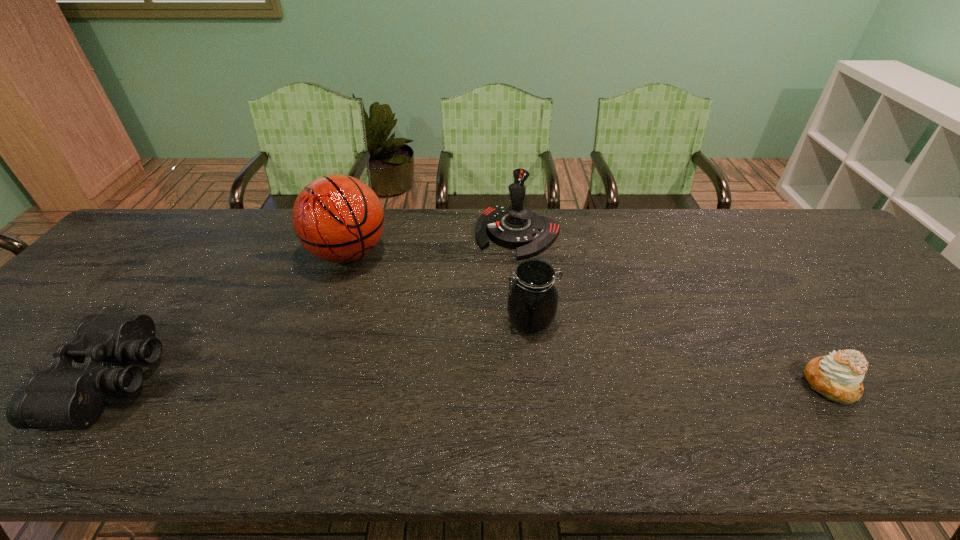
Identify the location of joystick located in the far edge section of the desktop. (516, 227).

Locate an element on the screen. This screenshot has width=960, height=540. binoculars located in the near edge section of the desktop is located at coordinates (62, 396).

Find the location of a particular element. Image resolution: width=960 pixels, height=540 pixels. pastry that is at the near edge is located at coordinates (838, 376).

Identify the location of vacant space at the far edge of the desktop. (718, 249).

In order to click on vacant space at the near edge of the desktop in this screenshot , I will do `click(342, 397)`.

Where is `free space at the left edge of the desktop`? The height and width of the screenshot is (540, 960). free space at the left edge of the desktop is located at coordinates (68, 309).

In the image, there is a desktop. Identify the location of vacant space at the far right corner. (787, 240).

At what (x,y) coordinates should I click in order to perform the action: click on vacant area at the near right corner. Please return your answer as a coordinate pair (x, y). Looking at the image, I should click on (912, 384).

Identify the location of free space between the jar and the tallest object. This screenshot has width=960, height=540. (440, 287).

The height and width of the screenshot is (540, 960). What are the coordinates of `free space between the third tallest object and the fourth object from right to left` in the screenshot? It's located at coord(440,287).